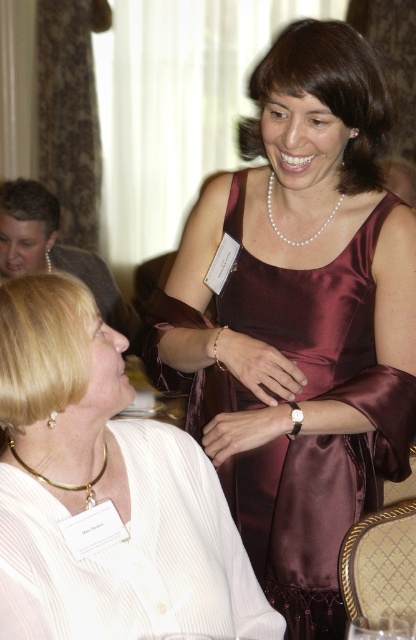
Question: Which point is farther to the camera?

Choices:
 (A) satin burgundy dress at center
 (B) pearl necklace at upper center
 (C) burgundy satin dress at center
 (D) gold chain necklace at lower left

Answer: (B)

Question: Is burgundy satin dress at center smaller than satin burgundy dress at center?

Choices:
 (A) yes
 (B) no

Answer: (B)

Question: Which point is farther to the camera?

Choices:
 (A) (403, 326)
 (B) (17, 458)
 (C) (190, 586)

Answer: (A)

Question: Which of the following is the farthest from the observer?

Choices:
 (A) (245, 557)
 (B) (269, 204)

Answer: (B)

Question: Is satin burgundy dress at center smaller than matte gold necklace at upper left?

Choices:
 (A) no
 (B) yes

Answer: (B)

Question: Is burgundy satin dress at center above matte gold necklace at upper left?

Choices:
 (A) no
 (B) yes

Answer: (A)